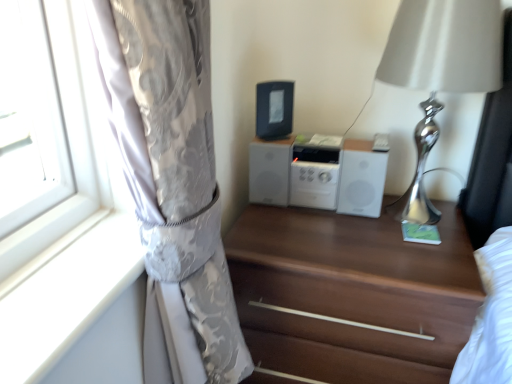
The width and height of the screenshot is (512, 384). I want to click on free space below silver metallic table lamp at right (from a real-world perspective), so click(x=403, y=220).